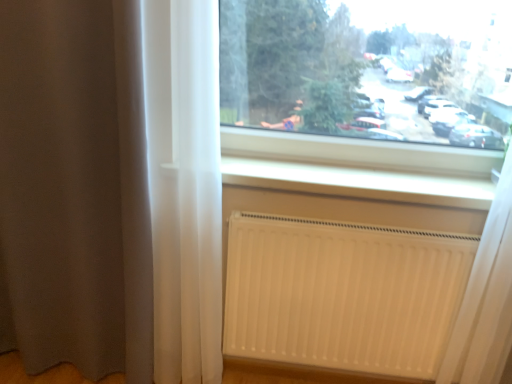
Question: Can you confirm if brown sheer curtain at left is wider than white matte radiator at lower right?

Choices:
 (A) yes
 (B) no

Answer: (A)

Question: Is brown sheer curtain at left with white matte radiator at lower right?

Choices:
 (A) no
 (B) yes

Answer: (A)

Question: From a real-world perspective, does brown sheer curtain at left sit lower than white matte radiator at lower right?

Choices:
 (A) no
 (B) yes

Answer: (A)

Question: Does brown sheer curtain at left have a lesser height compared to white matte radiator at lower right?

Choices:
 (A) no
 (B) yes

Answer: (A)

Question: Considering the relative sizes of brown sheer curtain at left and white matte radiator at lower right in the image provided, is brown sheer curtain at left taller than white matte radiator at lower right?

Choices:
 (A) yes
 (B) no

Answer: (A)

Question: Is the position of brown sheer curtain at left less distant than that of white matte radiator at lower right?

Choices:
 (A) no
 (B) yes

Answer: (B)

Question: Is brown sheer curtain at left located outside white smooth radiator at lower center?

Choices:
 (A) no
 (B) yes

Answer: (B)

Question: Is white smooth radiator at lower center surrounded by brown sheer curtain at left?

Choices:
 (A) yes
 (B) no

Answer: (B)

Question: Does brown sheer curtain at left have a greater width compared to white smooth radiator at lower center?

Choices:
 (A) no
 (B) yes

Answer: (B)

Question: Is brown sheer curtain at left closer to the viewer compared to white smooth radiator at lower center?

Choices:
 (A) yes
 (B) no

Answer: (A)

Question: Does brown sheer curtain at left appear on the right side of white smooth radiator at lower center?

Choices:
 (A) no
 (B) yes

Answer: (A)

Question: Can you confirm if brown sheer curtain at left is shorter than white smooth radiator at lower center?

Choices:
 (A) no
 (B) yes

Answer: (A)

Question: From the image's perspective, is white matte radiator at lower right below transparent glass window at upper center?

Choices:
 (A) no
 (B) yes

Answer: (B)